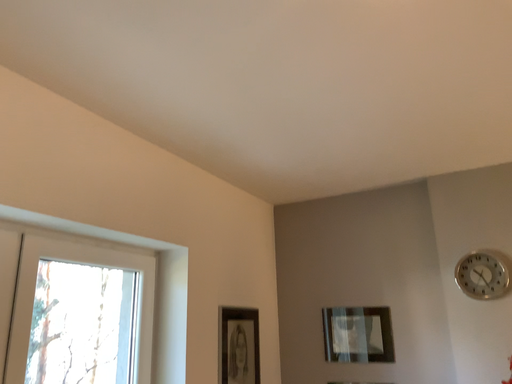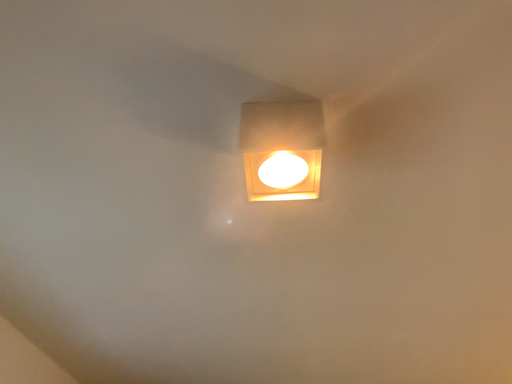
Question: Which way did the camera rotate in the video?

Choices:
 (A) rotated left
 (B) rotated right

Answer: (B)